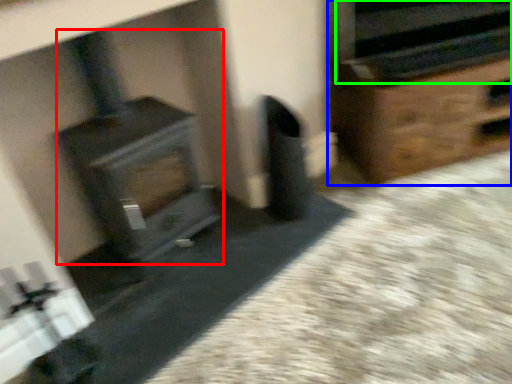
Question: Considering the real-world distances, which object is closest to wood burning stove (highlighted by a red box)? furniture (highlighted by a blue box) or stereo (highlighted by a green box).

Choices:
 (A) furniture
 (B) stereo

Answer: (A)